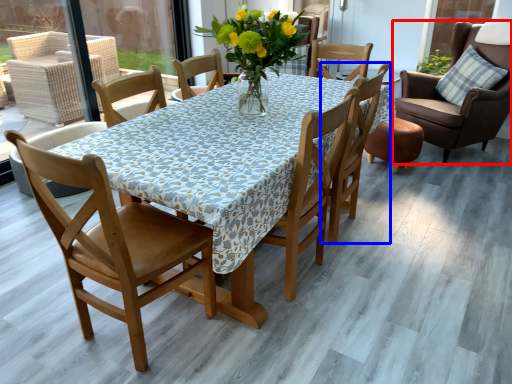
Question: Which point is further to the camera, chair (highlighted by a red box) or chair (highlighted by a blue box)?

Choices:
 (A) chair
 (B) chair

Answer: (A)